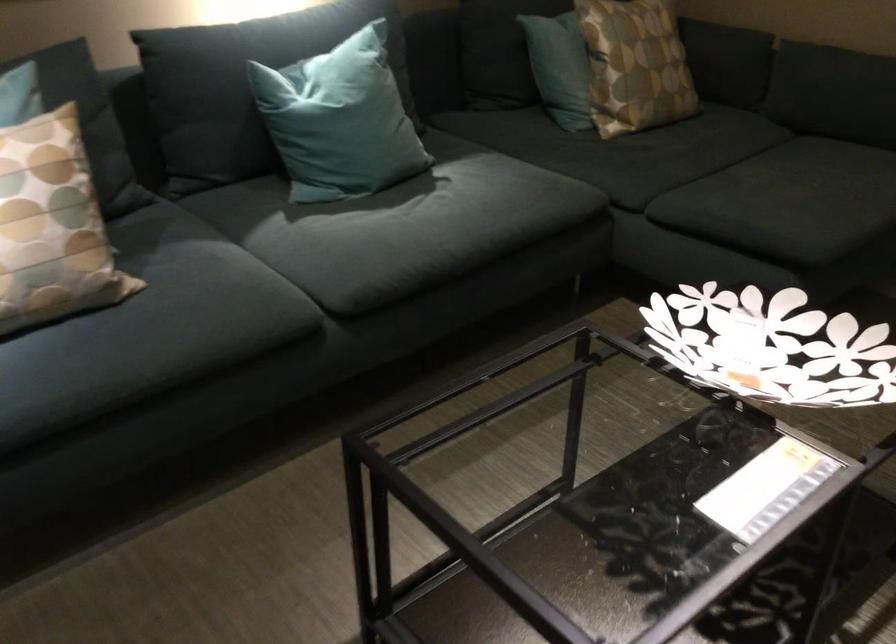
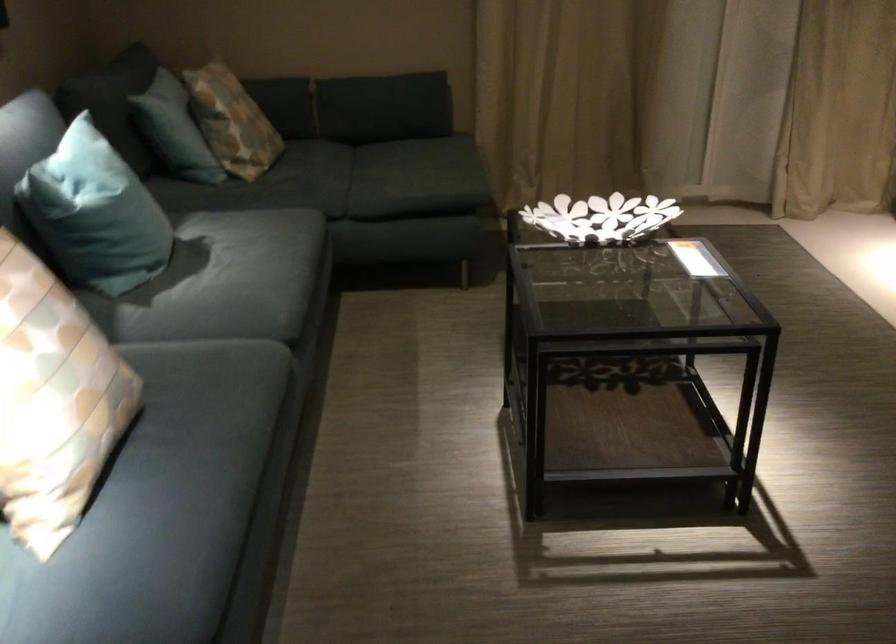
Locate, in the second image, the point that corresponds to (x=98, y=343) in the first image.

(197, 436)